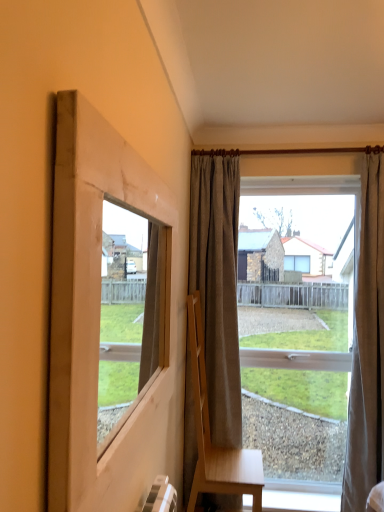
Question: From the image's perspective, is gray fabric curtain at center, the 2th curtain in the right-to-left sequence, above clear glass window at center?

Choices:
 (A) yes
 (B) no

Answer: (A)

Question: Considering the relative sizes of gray fabric curtain at center, the 2th curtain in the right-to-left sequence, and clear glass window at center in the image provided, is gray fabric curtain at center, the 2th curtain in the right-to-left sequence, taller than clear glass window at center?

Choices:
 (A) no
 (B) yes

Answer: (B)

Question: Is gray fabric curtain at center, the 2th curtain in the right-to-left sequence, positioned with its back to clear glass window at center?

Choices:
 (A) no
 (B) yes

Answer: (A)

Question: Is the position of gray fabric curtain at center, which appears as the 1th curtain when viewed from the left, more distant than that of clear glass window at center?

Choices:
 (A) no
 (B) yes

Answer: (A)

Question: Can you confirm if gray fabric curtain at center, which appears as the 1th curtain when viewed from the left, is smaller than clear glass window at center?

Choices:
 (A) no
 (B) yes

Answer: (B)

Question: From a real-world perspective, relative to natural wood window frame at left, is clear glass window at center vertically above or below?

Choices:
 (A) above
 (B) below

Answer: (B)

Question: Considering the positions of point (337, 184) and point (94, 221), is point (337, 184) closer or farther from the camera than point (94, 221)?

Choices:
 (A) farther
 (B) closer

Answer: (A)

Question: Is clear glass window at center in front of or behind natural wood window frame at left in the image?

Choices:
 (A) front
 (B) behind

Answer: (B)

Question: From the image's perspective, is clear glass window at center positioned above or below natural wood window frame at left?

Choices:
 (A) below
 (B) above

Answer: (A)

Question: In the image, is gray fabric curtain at center, the 2th curtain in the right-to-left sequence, on the left side or the right side of natural wood window frame at left?

Choices:
 (A) right
 (B) left

Answer: (A)

Question: From the image's perspective, is gray fabric curtain at center, which appears as the 1th curtain when viewed from the left, above or below natural wood window frame at left?

Choices:
 (A) above
 (B) below

Answer: (B)

Question: Looking at their shapes, would you say gray fabric curtain at center, the 2th curtain in the right-to-left sequence, is wider or thinner than natural wood window frame at left?

Choices:
 (A) wide
 (B) thin

Answer: (A)

Question: Choose the correct answer: Is gray fabric curtain at center, which appears as the 1th curtain when viewed from the left, inside natural wood window frame at left or outside it?

Choices:
 (A) outside
 (B) inside

Answer: (A)

Question: Looking at their shapes, would you say textured beige curtain at right, which is the 2th curtain from left to right, is wider or thinner than light brown wooden chair at center?

Choices:
 (A) thin
 (B) wide

Answer: (A)

Question: Considering the positions of textured beige curtain at right, which is the 2th curtain from left to right, and light brown wooden chair at center in the image, is textured beige curtain at right, which is the 2th curtain from left to right, taller or shorter than light brown wooden chair at center?

Choices:
 (A) short
 (B) tall

Answer: (B)